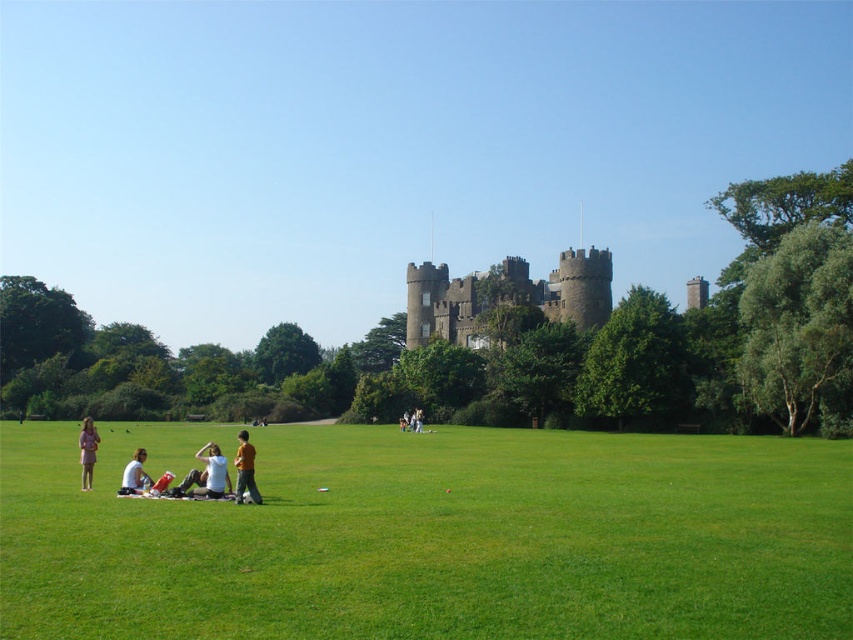
Who is more forward, (646,513) or (492,301)?

Point (646,513) is more forward.

Is green grass at lower center in front of brown stone castle at center?

Yes.

Does point (790, 588) come farther from viewer compared to point (515, 280)?

That is False.

Where is `green grass at lower center`? green grass at lower center is located at coordinates (432, 536).

Does white cotton shirt at lower center have a lesser height compared to light brown leather jacket at center?

No, white cotton shirt at lower center is not shorter than light brown leather jacket at center.

Is white cotton shirt at lower center positioned at the back of light brown leather jacket at center?

No, it is not.

Where is `white cotton shirt at lower center`? white cotton shirt at lower center is located at coordinates (213, 472).

In the scene shown: Can you confirm if brown leather jacket at lower center is wider than light brown leather jacket at center?

Correct, the width of brown leather jacket at lower center exceeds that of light brown leather jacket at center.

Who is taller, brown leather jacket at lower center or light brown leather jacket at center?

brown leather jacket at lower center is taller.

Identify the location of brown leather jacket at lower center. (245, 468).

Image resolution: width=853 pixels, height=640 pixels. In order to click on brown leather jacket at lower center in this screenshot , I will do `click(245, 468)`.